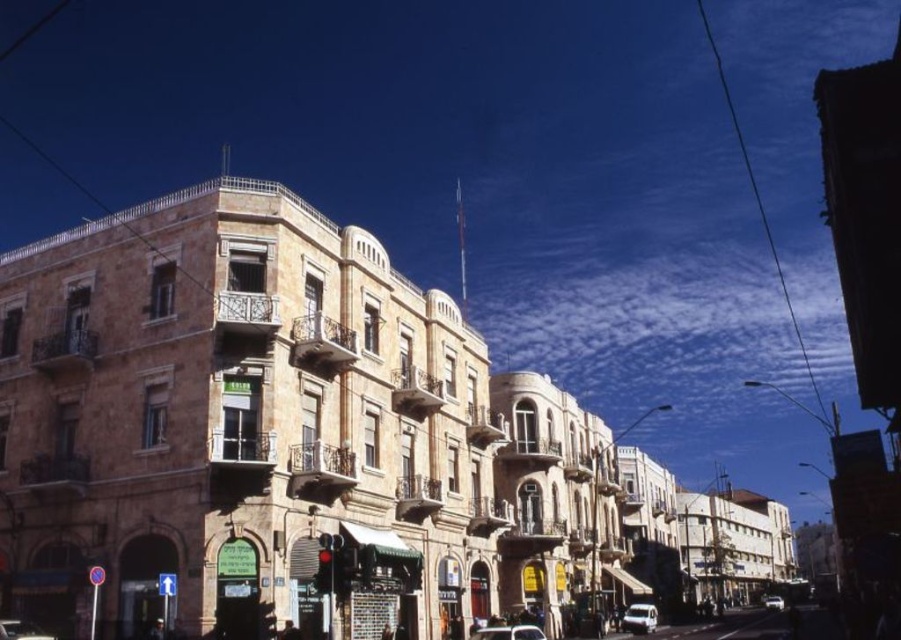
Question: Based on their relative distances, which object is farther from the white glossy car at center?

Choices:
 (A) metallic silver car at center
 (B) white matte van at lower right

Answer: (A)

Question: Which of the following is the farthest from the observer?

Choices:
 (A) (11, 632)
 (B) (777, 605)
 (C) (648, 618)

Answer: (B)

Question: Can you confirm if white matte van at lower right is bigger than shiny silver car at lower left?

Choices:
 (A) no
 (B) yes

Answer: (B)

Question: Is the position of white matte van at lower right more distant than that of white glossy car at center?

Choices:
 (A) yes
 (B) no

Answer: (B)

Question: Does white matte van at lower right have a larger size compared to white glossy car at center?

Choices:
 (A) no
 (B) yes

Answer: (A)

Question: Estimate the real-world distances between objects in this image. Which object is closer to the white matte van at lower right?

Choices:
 (A) shiny silver car at lower left
 (B) metallic silver car at center
 (C) white glossy car at center

Answer: (B)